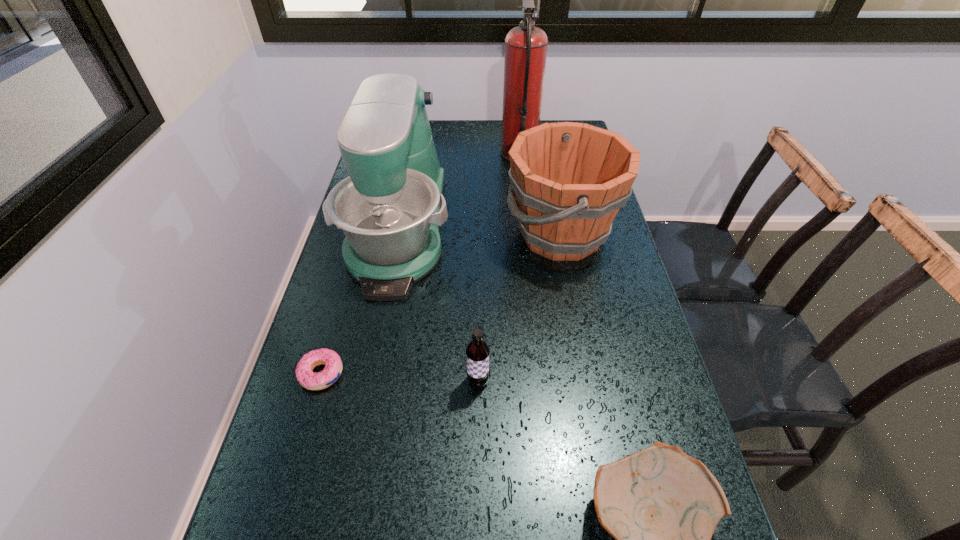
Find the location of a particular element. The image size is (960, 540). free space that satisfies the following two spatial constraints: 1. at the nozzle of the fire extinguisher; 2. on the front-facing side of the second tallest object is located at coordinates (528, 230).

Locate an element on the screen. Image resolution: width=960 pixels, height=540 pixels. free point that satisfies the following two spatial constraints: 1. at the nozzle of the farthest object; 2. on the front-facing side of the mixer is located at coordinates coord(528,230).